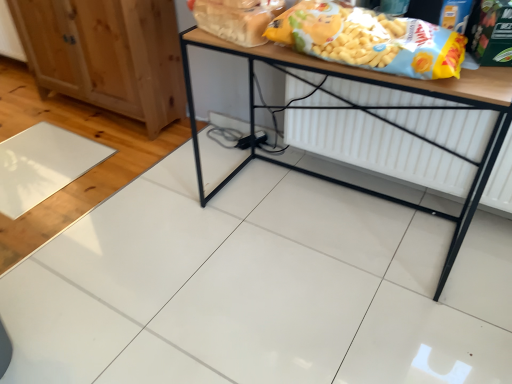
Question: From their relative heights in the image, would you say wooden table at center is taller or shorter than natural wood cabinet at left?

Choices:
 (A) short
 (B) tall

Answer: (B)

Question: Is wooden table at center to the left or to the right of natural wood cabinet at left in the image?

Choices:
 (A) left
 (B) right

Answer: (B)

Question: Which object is the farthest from the yellow matte cereal at upper right, positioned as the second cereal in left-to-right order?

Choices:
 (A) white matte radiator at lower center
 (B) translucent plastic bag of bread at upper center, which is counted as the 1th cereal, starting from the left
 (C) natural wood cabinet at left
 (D) wooden table at center

Answer: (C)

Question: Estimate the real-world distances between objects in this image. Which object is closer to the yellow matte cereal at upper right, positioned as the second cereal in left-to-right order?

Choices:
 (A) white matte radiator at lower center
 (B) natural wood cabinet at left
 (C) translucent plastic bag of bread at upper center, positioned as the second cereal in right-to-left order
 (D) wooden table at center

Answer: (C)